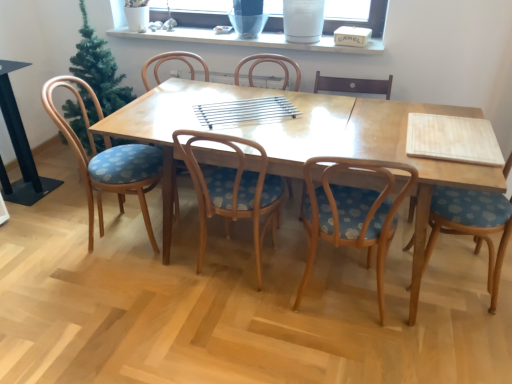
Locate an element on the screen. The width and height of the screenshot is (512, 384). free space in front of wooden chair with blue patterned seat at center, the 5th chair in the right-to-left sequence is located at coordinates (196, 242).